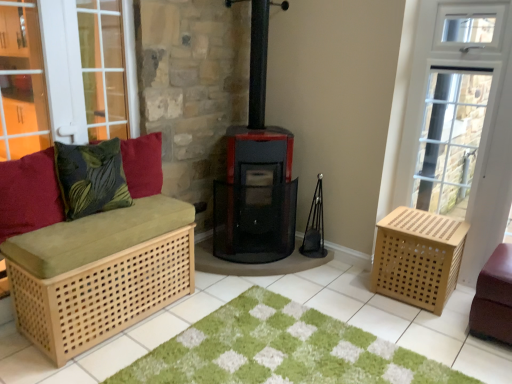
You are a GUI agent. You are given a task and a screenshot of the screen. Output one action in this format:
    pyautogui.click(x=<x>, y=<y>)
    Task: Click on the vacant space situated on the left part of natural wood crate at right
    The image size is (512, 384).
    Given the screenshot: What is the action you would take?
    pyautogui.click(x=351, y=289)